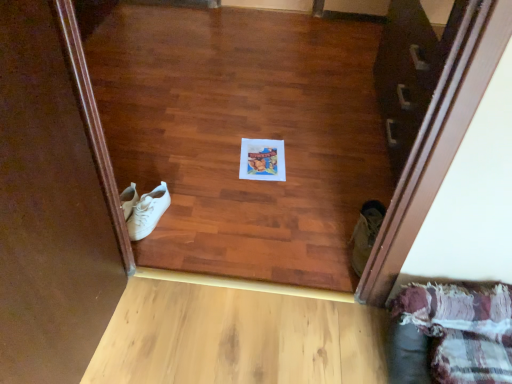
Identify the location of free space between wooden door at center and white leather sneakers at left, placed as the 1th footwear when sorted from left to right. The width and height of the screenshot is (512, 384). (297, 164).